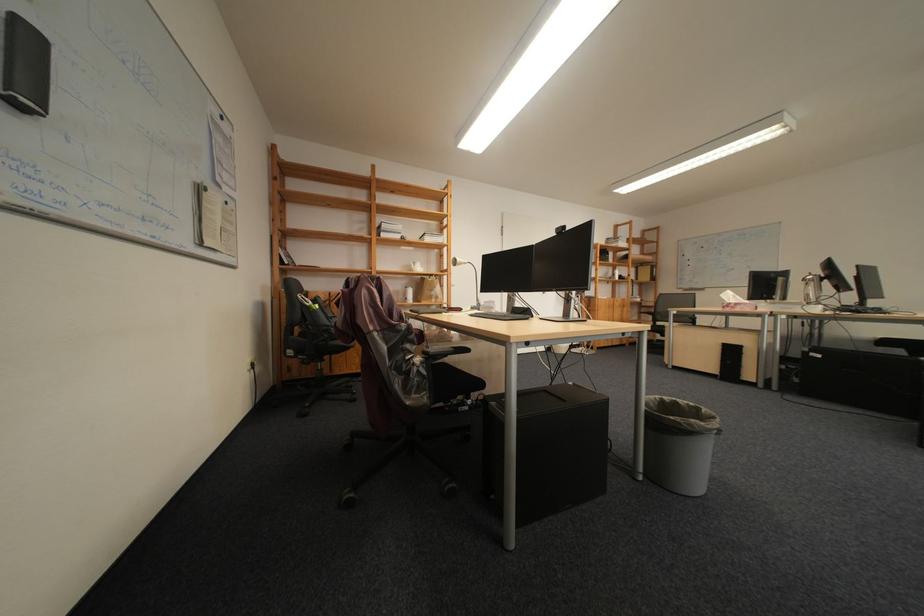
In order to click on black whiteboard eraser in this screenshot , I will do `click(25, 66)`.